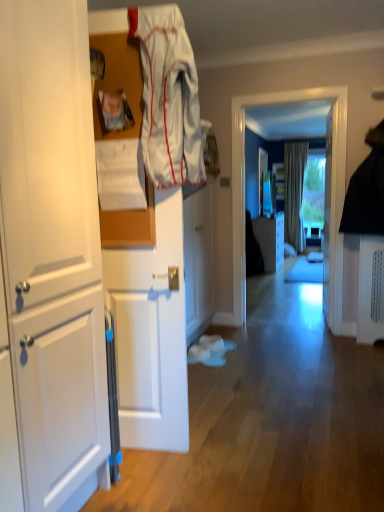
Question: Is white matte cabinet at left, the 1th cabinetry when ordered from left to right, looking in the opposite direction of white glossy door at center?

Choices:
 (A) yes
 (B) no

Answer: (B)

Question: Is white matte cabinet at left, the 3th cabinetry viewed from the right, thinner than white glossy door at center?

Choices:
 (A) no
 (B) yes

Answer: (A)

Question: Is white matte cabinet at left, placed as the 1th cabinetry when sorted from front to back, behind white glossy door at center?

Choices:
 (A) no
 (B) yes

Answer: (A)

Question: Is white matte cabinet at left, placed as the 1th cabinetry when sorted from front to back, to the right of white glossy door at center from the viewer's perspective?

Choices:
 (A) yes
 (B) no

Answer: (B)

Question: Can you confirm if white matte cabinet at left, marked as the 3th cabinetry in a back-to-front arrangement, is taller than white glossy door at center?

Choices:
 (A) no
 (B) yes

Answer: (B)

Question: Looking at the image, does white fabric at upper center seem bigger or smaller compared to matte plastic photo frame at upper left?

Choices:
 (A) big
 (B) small

Answer: (A)

Question: From a real-world perspective, is white fabric at upper center physically located above or below matte plastic photo frame at upper left?

Choices:
 (A) below
 (B) above

Answer: (A)

Question: Does point (195, 128) appear closer or farther from the camera than point (117, 95)?

Choices:
 (A) closer
 (B) farther

Answer: (A)

Question: From the image's perspective, is white fabric at upper center located above or below matte plastic photo frame at upper left?

Choices:
 (A) below
 (B) above

Answer: (A)

Question: Considering the positions of white glossy door at center and white matte cabinet at left, placed as the 1th cabinetry when sorted from front to back, in the image, is white glossy door at center taller or shorter than white matte cabinet at left, placed as the 1th cabinetry when sorted from front to back,?

Choices:
 (A) tall
 (B) short

Answer: (B)

Question: From the image's perspective, is white glossy door at center located above or below white matte cabinet at left, the 1th cabinetry when ordered from left to right?

Choices:
 (A) above
 (B) below

Answer: (A)

Question: Is white glossy door at center situated inside white matte cabinet at left, the 3th cabinetry viewed from the right, or outside?

Choices:
 (A) outside
 (B) inside

Answer: (A)

Question: In the image, is white glossy door at center positioned in front of or behind white matte cabinet at left, the 3th cabinetry viewed from the right?

Choices:
 (A) behind
 (B) front

Answer: (A)

Question: Is transparent glass window at center in front of or behind white fabric at upper center in the image?

Choices:
 (A) behind
 (B) front

Answer: (A)

Question: From the image's perspective, relative to white fabric at upper center, is transparent glass window at center above or below?

Choices:
 (A) above
 (B) below

Answer: (B)